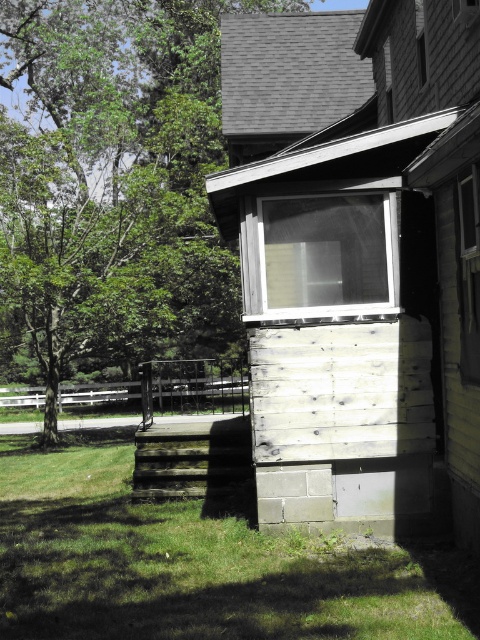
Question: Does green leafy tree at upper left have a larger size compared to green grass at lower left?

Choices:
 (A) no
 (B) yes

Answer: (B)

Question: Among these points, which one is farthest from the camera?

Choices:
 (A) (302, 632)
 (B) (214, 144)

Answer: (B)

Question: Which of the following is the closest to the observer?

Choices:
 (A) green leafy tree at upper left
 (B) green grass at lower left

Answer: (B)

Question: Observing the image, what is the correct spatial positioning of green leafy tree at upper left in reference to green grass at lower left?

Choices:
 (A) above
 (B) below

Answer: (A)

Question: Does green leafy tree at upper left have a greater width compared to green grass at lower left?

Choices:
 (A) yes
 (B) no

Answer: (A)

Question: Among these objects, which one is farthest from the camera?

Choices:
 (A) green grass at lower left
 (B) green leafy tree at upper left

Answer: (B)